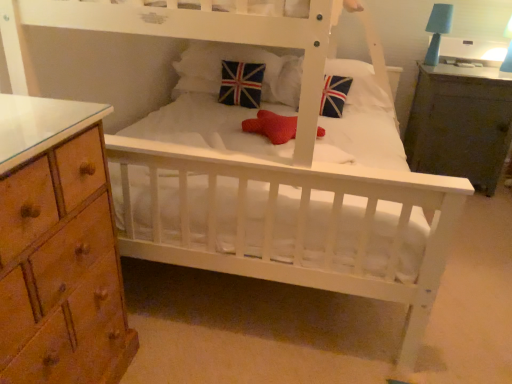
Question: From a real-world perspective, is union jack fabric pillow at center, which is the first pillow from left to right, on union jack fabric pillow at center?

Choices:
 (A) yes
 (B) no

Answer: (A)

Question: Is union jack fabric pillow at center, the 2th pillow viewed from the right, outside of union jack fabric pillow at center?

Choices:
 (A) no
 (B) yes

Answer: (B)

Question: Can you confirm if union jack fabric pillow at center, the 2th pillow viewed from the right, is bigger than union jack fabric pillow at center?

Choices:
 (A) yes
 (B) no

Answer: (A)

Question: Does union jack fabric pillow at center, which is the first pillow from left to right, have a lesser height compared to union jack fabric pillow at center?

Choices:
 (A) yes
 (B) no

Answer: (A)

Question: From a real-world perspective, is union jack fabric pillow at center, the 2th pillow viewed from the right, under union jack fabric pillow at center?

Choices:
 (A) no
 (B) yes

Answer: (A)

Question: From the image's perspective, is red mesh star at center above or below blue matte table lamp at upper right?

Choices:
 (A) above
 (B) below

Answer: (B)

Question: Is red mesh star at center situated inside blue matte table lamp at upper right or outside?

Choices:
 (A) outside
 (B) inside

Answer: (A)

Question: In the image, is red mesh star at center positioned in front of or behind blue matte table lamp at upper right?

Choices:
 (A) front
 (B) behind

Answer: (A)

Question: In terms of size, does red mesh star at center appear bigger or smaller than blue matte table lamp at upper right?

Choices:
 (A) small
 (B) big

Answer: (B)

Question: From a real-world perspective, is blue matte table lamp at upper right above or below union jack fabric pillow at center, the 2th pillow viewed from the right?

Choices:
 (A) below
 (B) above

Answer: (B)

Question: Is blue matte table lamp at upper right inside the boundaries of union jack fabric pillow at center, which is the first pillow from left to right, or outside?

Choices:
 (A) inside
 (B) outside

Answer: (B)

Question: Relative to union jack fabric pillow at center, the 2th pillow viewed from the right, is blue matte table lamp at upper right in front or behind?

Choices:
 (A) behind
 (B) front

Answer: (A)

Question: Looking at their shapes, would you say blue matte table lamp at upper right is wider or thinner than union jack fabric pillow at center, which is the first pillow from left to right?

Choices:
 (A) thin
 (B) wide

Answer: (A)

Question: From the image's perspective, is union jack fabric pillow at center, which is the first pillow from left to right, positioned above or below dark wood nightstand at right?

Choices:
 (A) above
 (B) below

Answer: (A)

Question: Is union jack fabric pillow at center, the 2th pillow viewed from the right, situated inside dark wood nightstand at right or outside?

Choices:
 (A) outside
 (B) inside

Answer: (A)